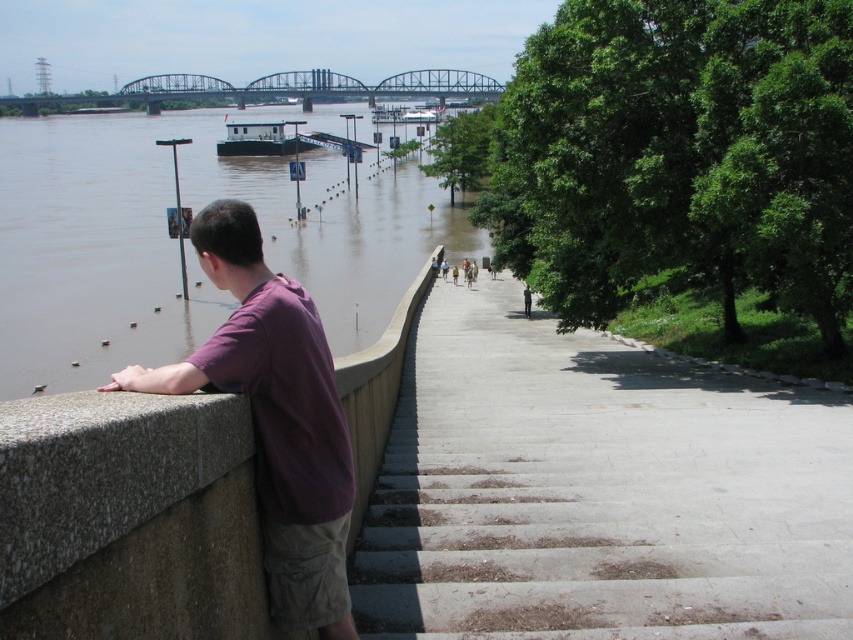
You are standing on the raised walkway and see the brown muddy water at left and the purple cotton shirt at left. Which object is positioned more to the left side?

The brown muddy water at left is more to the left side than the purple cotton shirt at left.

You are a photographer standing on the walkway and want to capture both the purple cotton shirt at left and the brushed metal bridge at upper center in the same frame. Which object should you zoom in on to ensure both are visible?

You should zoom in on the purple cotton shirt at left because it is shorter than the brushed metal bridge at upper center, allowing both to fit within the frame when focusing on the lower object.

You are a photographer trying to capture the scene from the walkway. You notice the purple cotton shirt at left and the white matte barge at center. Which object is wider in the image?

The white matte barge at center is wider than the purple cotton shirt at left.